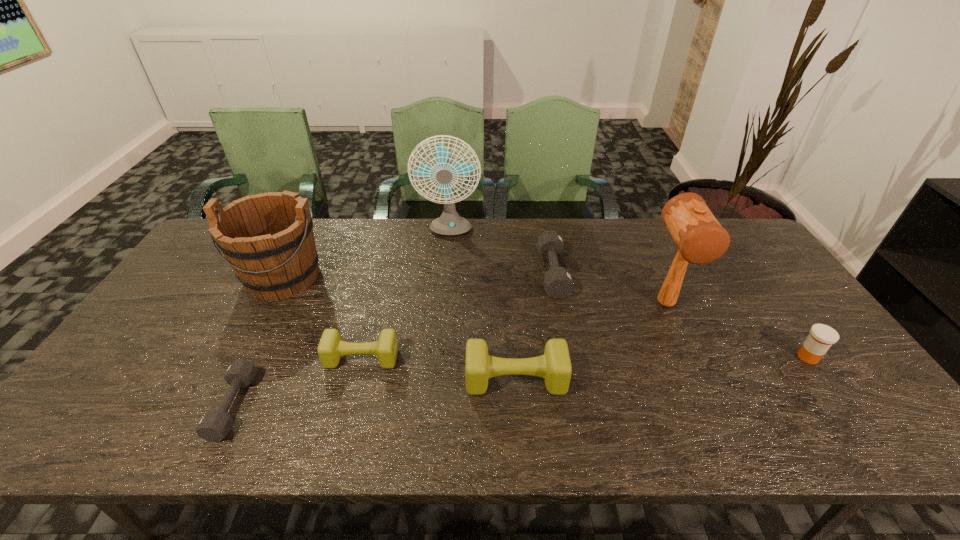
At what (x,y) coordinates should I click in order to perform the action: click on the left olive dumbbell. Please return your answer as a coordinate pair (x, y). This screenshot has height=540, width=960. Looking at the image, I should click on (331, 347).

This screenshot has height=540, width=960. What are the coordinates of `the smaller olive dumbbell` in the screenshot? It's located at (331, 347).

Find the location of a particular element. Image resolution: width=960 pixels, height=540 pixels. the smaller gray dumbbell is located at coordinates (214, 425).

What are the coordinates of `the shortest dumbbell` in the screenshot? It's located at point(214,425).

This screenshot has height=540, width=960. Identify the location of vacant space situated on the front-facing side of the gray fan. (442, 315).

The height and width of the screenshot is (540, 960). Find the location of `vacant point located 0.320m on the strike surface of the mallet`. vacant point located 0.320m on the strike surface of the mallet is located at coordinates (725, 435).

In order to click on free point located 0.370m on the side of the third tallest object with the handle for carrying in this screenshot , I will do `click(209, 421)`.

This screenshot has height=540, width=960. In order to click on free space located on the front of the tallest dumbbell in this screenshot , I will do `click(519, 429)`.

Identify the location of free space located 0.090m on the label of the orange medicine. (836, 397).

Where is `blank space located 0.400m on the front of the farthest dumbbell`? blank space located 0.400m on the front of the farthest dumbbell is located at coordinates (582, 423).